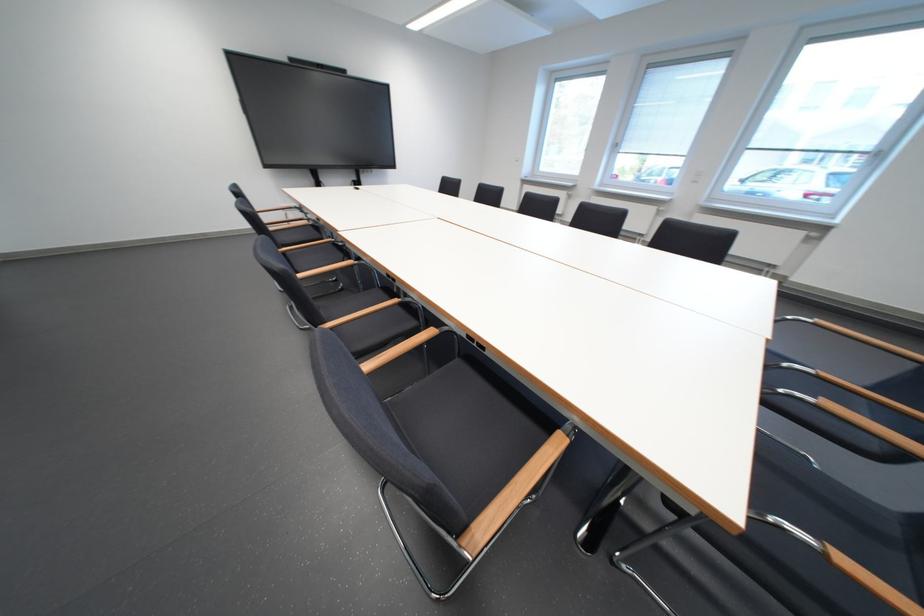
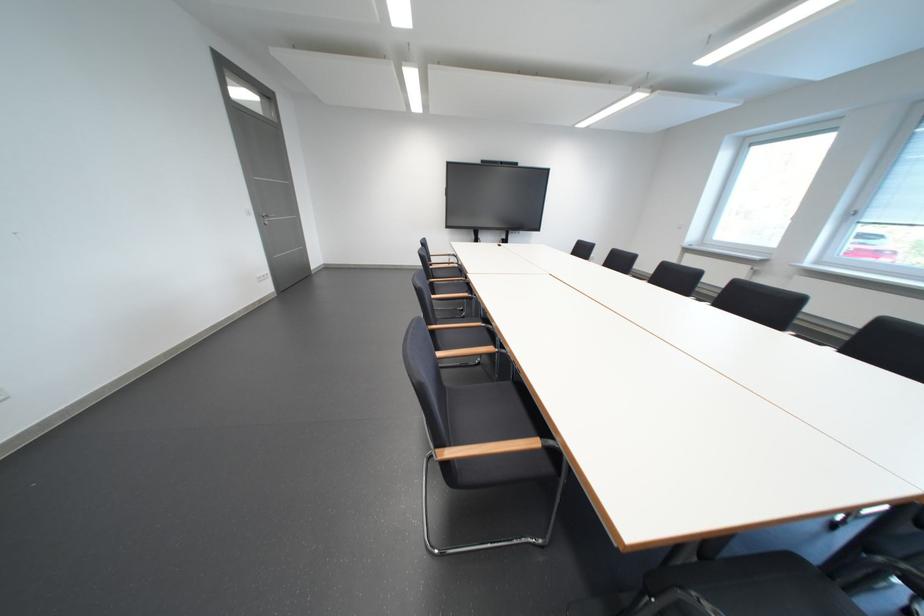
Question: The first image is from the beginning of the video and the second image is from the end. How did the camera likely rotate when shooting the video?

Choices:
 (A) Left
 (B) Right
 (C) Up
 (D) Down

Answer: (A)